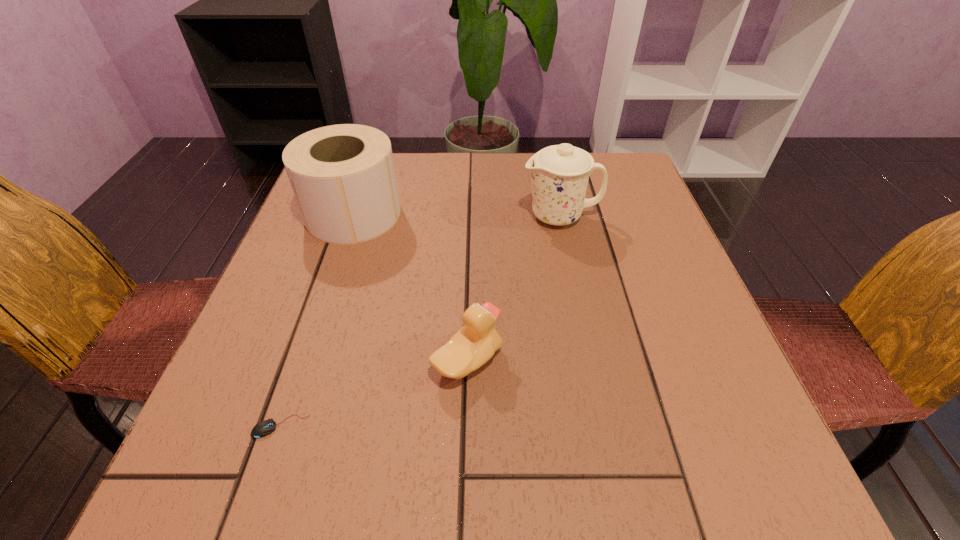
This screenshot has height=540, width=960. I want to click on object that is at the far right corner, so click(560, 173).

This screenshot has width=960, height=540. In the image, there is a desktop. In order to click on blank space at the far edge in this screenshot , I will do `click(420, 185)`.

Where is `vacant space at the near edge of the desktop`? vacant space at the near edge of the desktop is located at coordinates (473, 441).

The width and height of the screenshot is (960, 540). In the image, there is a desktop. What are the coordinates of `vacant space at the left edge` in the screenshot? It's located at (305, 381).

Locate an element on the screen. Image resolution: width=960 pixels, height=540 pixels. vacant region at the right edge is located at coordinates (630, 290).

In the image, there is a desktop. At what (x,y) coordinates should I click in order to perform the action: click on vacant space at the far right corner. Please return your answer as a coordinate pair (x, y). The width and height of the screenshot is (960, 540). Looking at the image, I should click on (611, 183).

The height and width of the screenshot is (540, 960). I want to click on free spot between the mouse and the chinaware, so click(x=420, y=321).

At what (x,y) coordinates should I click in order to perform the action: click on blank region between the second shortest object and the rightmost object. Please return your answer as a coordinate pair (x, y). Looking at the image, I should click on (x=514, y=288).

Locate an element on the screen. free space between the chinaware and the toilet tissue is located at coordinates (457, 215).

Identify the location of free space between the toilet tissue and the third farthest object. This screenshot has height=540, width=960. (410, 287).